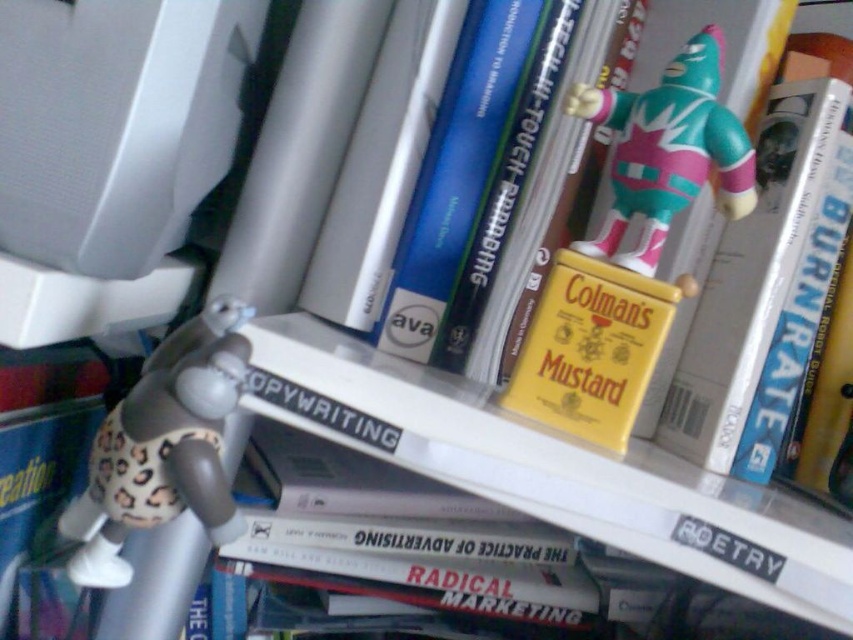
You are standing in front of the shelf and want to reach a point that is 19.41 inches away from you. Can you confirm if the point at coordinates (753,333) on the shelf is the correct location to reach?

Yes, the point at coordinates (753,333) on the shelf is the correct location to reach since it is 19.41 inches away from you.

In the scene shown: You are a photographer setting up a shot of the shelf. You want to focus on the leopard print fabric monkey at lower left. If your camera can focus on objects within 12 inches, will you need to adjust your position?

The leopard print fabric monkey at lower left is 13.40 inches away from the viewer. Since your camera can focus within 12 inches, you need to move closer to ensure proper focus.

You are organizing a shelf and need to place a new book. The shelf has a coordinate system where the bottom left corner is the origin. The yellow matte mustard container at upper right is at point (x=764, y=289). If you want to place the new book 10 units to the right of the yellow matte mustard container at upper right, what would be the new coordinates?

The new coordinates would be 0.452 plus 10 units in the x direction, so 1.452, 0.898. However, since the coordinate system is normalized between 0 and 1, exceeding 1 is not possible. Therefore, the book cannot be placed 10 units to the right of the yellow matte mustard container at upper right within the shelf.